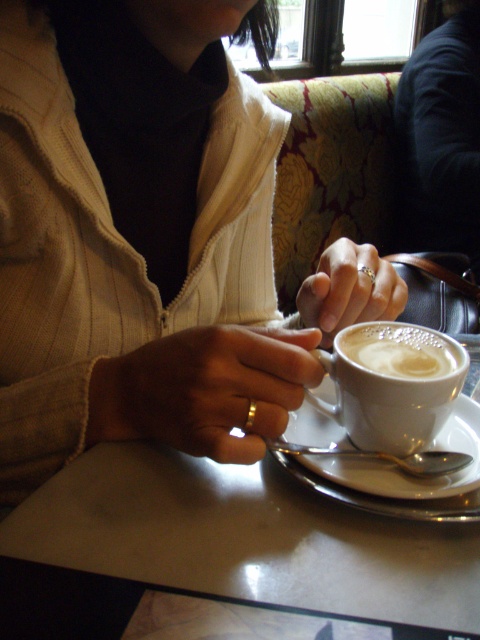
Question: Is matte white cup at center closer to the viewer compared to white glossy table at center?

Choices:
 (A) no
 (B) yes

Answer: (A)

Question: Is white glossy table at center to the right of white matte cup at center from the viewer's perspective?

Choices:
 (A) yes
 (B) no

Answer: (B)

Question: Can you confirm if matte white cup at center is smaller than white frothy coffee at center?

Choices:
 (A) yes
 (B) no

Answer: (B)

Question: Estimate the real-world distances between objects in this image. Which object is farther from the white glossy table at center?

Choices:
 (A) white matte cup at center
 (B) matte white cup at center
 (C) white frothy coffee at center
 (D) white ceramic saucer at lower center

Answer: (B)

Question: Which of the following is the farthest from the observer?

Choices:
 (A) (388, 342)
 (B) (323, 435)

Answer: (B)

Question: Which object is farther from the camera taking this photo?

Choices:
 (A) white matte cup at center
 (B) white ceramic saucer at lower center
 (C) white glossy table at center
 (D) matte white cup at center

Answer: (B)